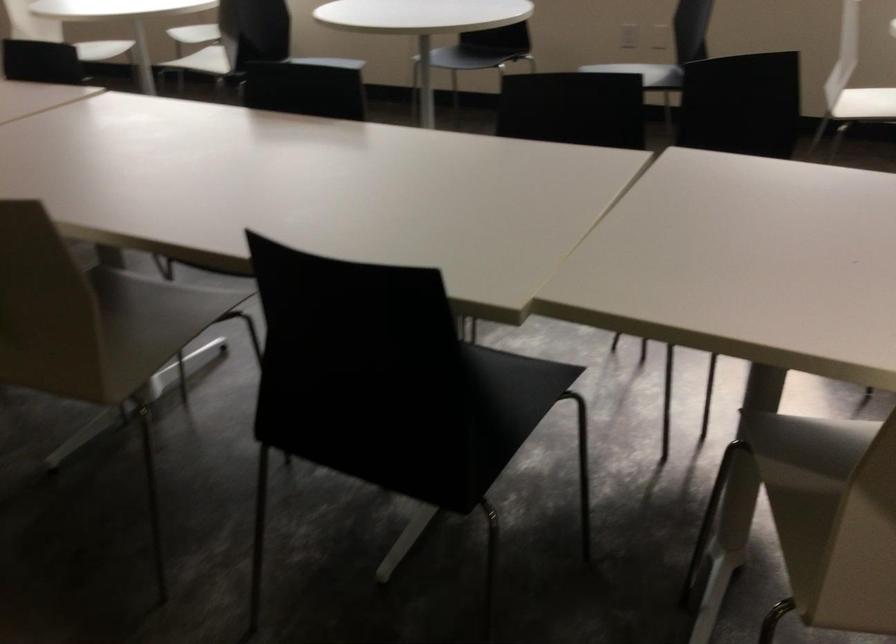
Find where to sit the black chair sitting surface. Please return your answer as a coordinate pair (x, y).

(515, 395)